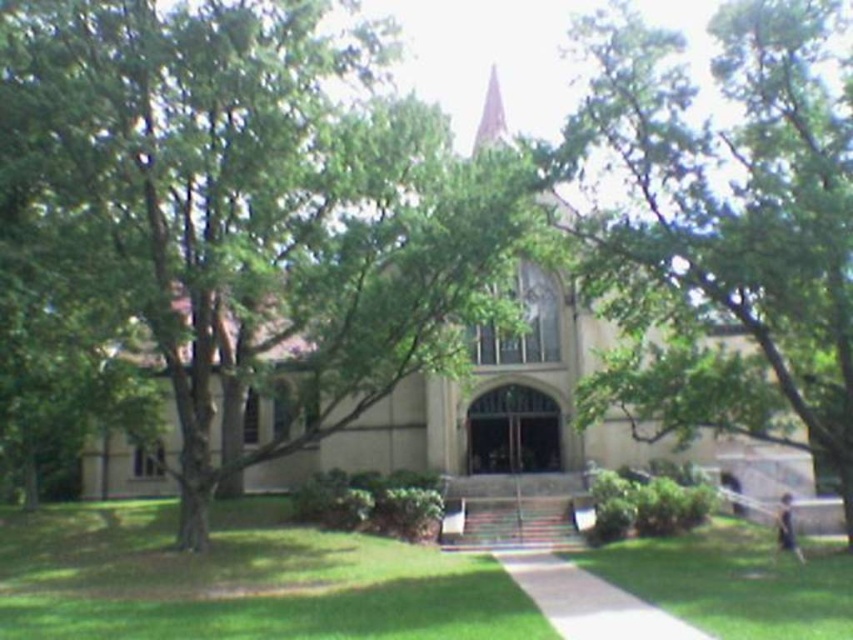
Does green leafy tree at center appear on the left side of light brown stone spire at upper center?

In fact, green leafy tree at center is to the right of light brown stone spire at upper center.

Is green leafy tree at center positioned at the back of light brown stone spire at upper center?

No, it is in front of light brown stone spire at upper center.

Which is in front, point (579, 157) or point (498, 84)?

Point (579, 157) is more forward.

The image size is (853, 640). In order to click on green leafy tree at center in this screenshot , I will do `click(723, 227)`.

Is green leafy tree at center to the right of beige stone church at center from the viewer's perspective?

Indeed, green leafy tree at center is positioned on the right side of beige stone church at center.

Does green leafy tree at center have a larger size compared to beige stone church at center?

No.

Does point (807, 76) come farther from viewer compared to point (596, 328)?

No, it is in front of (596, 328).

Locate an element on the screen. The height and width of the screenshot is (640, 853). green leafy tree at center is located at coordinates (723, 227).

Image resolution: width=853 pixels, height=640 pixels. What do you see at coordinates (241, 580) in the screenshot?
I see `green grass at center` at bounding box center [241, 580].

Between point (251, 595) and point (526, 380), which one is positioned behind?

Positioned behind is point (526, 380).

Identify the location of green grass at center. (241, 580).